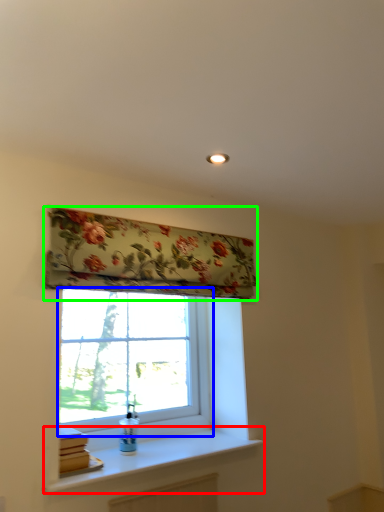
Question: Which object is positioned farthest from window sill (highlighted by a red box)? Select from window (highlighted by a blue box) and window blind (highlighted by a green box).

Choices:
 (A) window
 (B) window blind

Answer: (B)